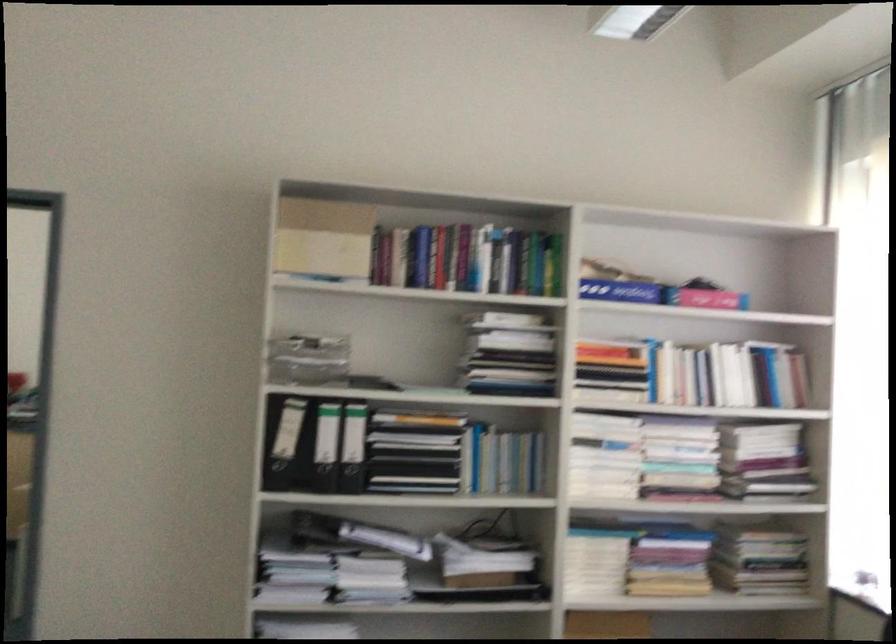
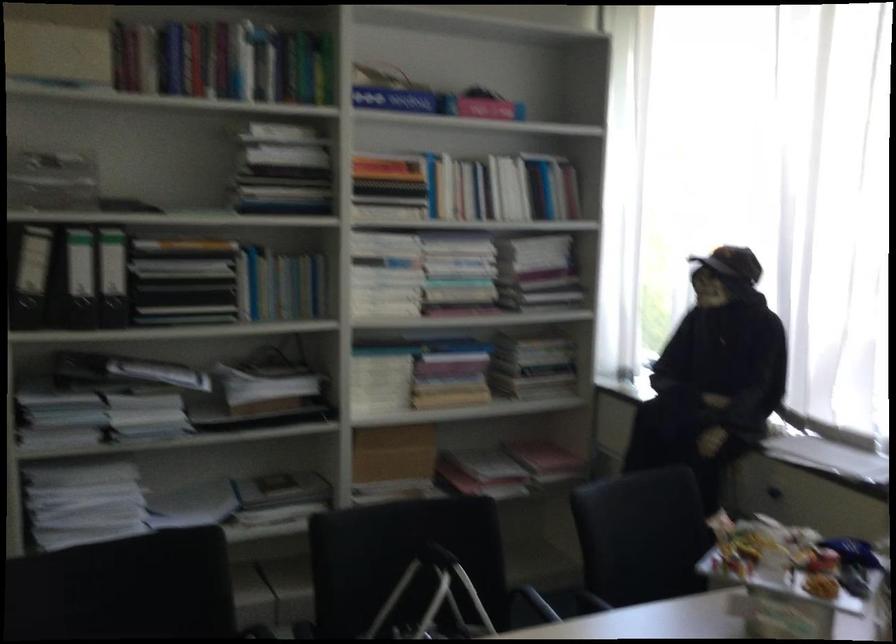
Find the pixel in the second image that matches the point at 348,449 in the first image.

(113, 277)